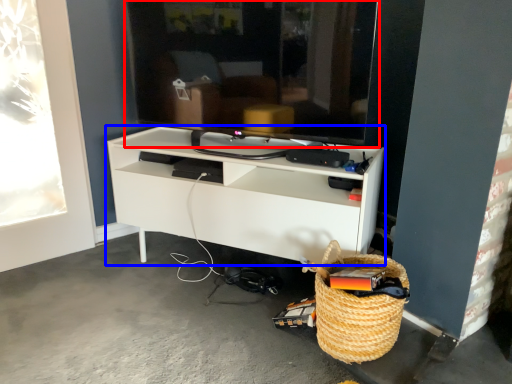
Question: Which of the following is the closest to the observer, television (highlighted by a red box) or shelf (highlighted by a blue box)?

Choices:
 (A) television
 (B) shelf

Answer: (A)